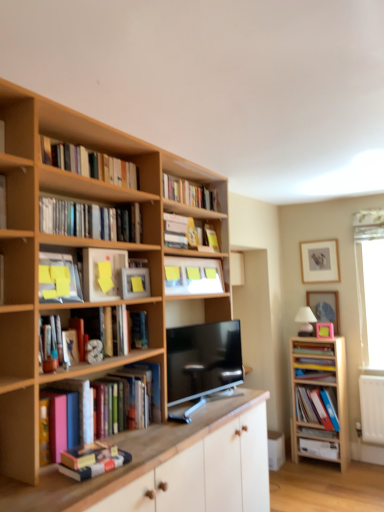
What do you see at coordinates (170, 467) in the screenshot?
I see `wooden cabinet at center, the first cabinetry in the front-to-back sequence` at bounding box center [170, 467].

What is the approximate height of matte yellow paper at center-left?

The height of matte yellow paper at center-left is 10.19 inches.

Where is `matte silver picture frame at upper right, the third picture frame from the bottom`? Image resolution: width=384 pixels, height=512 pixels. matte silver picture frame at upper right, the third picture frame from the bottom is located at coordinates (320, 261).

In the scene shown: What is the approximate width of matte silver picture frame at upper right, placed as the 1th picture frame when sorted from top to bottom?

matte silver picture frame at upper right, placed as the 1th picture frame when sorted from top to bottom, is 3.52 centimeters in width.

Measure the distance between point (x=311, y=365) and camera.

A distance of 11.98 feet exists between point (x=311, y=365) and camera.

What do you see at coordinates (313, 349) in the screenshot?
I see `wooden book at right, the fourth book ordered from the bottom` at bounding box center [313, 349].

Find the location of a particular element. This screenshot has height=512, width=384. matte wooden book at left, arranged as the third book when viewed from the top is located at coordinates (3, 203).

Which is farther, (188, 347) or (106, 209)?

Positioned behind is point (188, 347).

What's the angular difference between black glossy tv at center and hardcover books at upper left, which is the 4th book in top-to-bottom order,'s facing directions?

black glossy tv at center and hardcover books at upper left, which is the 4th book in top-to-bottom order, are facing 7.6 degrees away from each other.

Is black glossy tv at center in contact with hardcover books at upper left, which is the eighth book from bottom to top?

No.

From a real-world perspective, is black glossy tv at center under hardcover books at upper left, which is the eighth book from bottom to top?

Yes, from a real-world perspective, black glossy tv at center is below hardcover books at upper left, which is the eighth book from bottom to top.

From the image's perspective, between matte plastic book at left, which ranks as the sixth book in bottom-to-top order, and black glossy tv at center, who is located below?

black glossy tv at center, from the image's perspective.

Is point (40, 264) positioned after point (239, 353)?

No, it is in front of (239, 353).

Is matte plastic book at left, which ranks as the sixth book in bottom-to-top order, not within black glossy tv at center?

That's correct, matte plastic book at left, which ranks as the sixth book in bottom-to-top order, is outside of black glossy tv at center.

From a real-world perspective, is matte blue book at right, the tenth book in the top-to-bottom sequence, physically below pink matte picture frame at upper center, acting as the 3th picture frame starting from the top?

Yes, from a real-world perspective, matte blue book at right, the tenth book in the top-to-bottom sequence, is under pink matte picture frame at upper center, acting as the 3th picture frame starting from the top.

From the picture: Is the depth of matte blue book at right, the tenth book in the top-to-bottom sequence, less than that of pink matte picture frame at upper center, placed as the 1th picture frame when sorted from bottom to top?

Yes, matte blue book at right, the tenth book in the top-to-bottom sequence, is closer to the viewer.

From the image's perspective, starting from the matte blue book at right, the tenth book in the top-to-bottom sequence, which picture frame is the 1st one above? Please provide its 2D coordinates.

[(325, 330)]

Measure the distance between matte blue book at right, the tenth book in the top-to-bottom sequence, and pink matte picture frame at upper center, acting as the 3th picture frame starting from the top.

matte blue book at right, the tenth book in the top-to-bottom sequence, is 13.74 inches from pink matte picture frame at upper center, acting as the 3th picture frame starting from the top.

Considering the positions of points (181, 287) and (323, 335), is point (181, 287) farther from camera compared to point (323, 335)?

No, it is not.

Does yellow sticky notes at upper center touch pink matte picture frame at upper center, acting as the 3th picture frame starting from the top?

yellow sticky notes at upper center and pink matte picture frame at upper center, acting as the 3th picture frame starting from the top, are not in contact.

Could you measure the distance between yellow sticky notes at upper center and pink matte picture frame at upper center, acting as the 3th picture frame starting from the top?

yellow sticky notes at upper center and pink matte picture frame at upper center, acting as the 3th picture frame starting from the top, are 1.50 meters apart from each other.

From a real-world perspective, is yellow sticky notes at upper center positioned above or below pink matte picture frame at upper center, placed as the 1th picture frame when sorted from bottom to top?

From a real-world perspective, yellow sticky notes at upper center is physically above pink matte picture frame at upper center, placed as the 1th picture frame when sorted from bottom to top.

From a real-world perspective, is wooden cabinet at right, which appears as the 2th cabinetry when viewed from the left, beneath matte plastic book at left, the 6th book in the top-to-bottom sequence?

Yes, from a real-world perspective, wooden cabinet at right, which appears as the 2th cabinetry when viewed from the left, is under matte plastic book at left, the 6th book in the top-to-bottom sequence.

The height and width of the screenshot is (512, 384). I want to click on book that is the 6th object located in front of the wooden cabinet at right, which is the first cabinetry from back to front, so click(x=58, y=278).

How different are the orientations of wooden cabinet at right, which appears as the 2th cabinetry when viewed from the left, and matte plastic book at left, which ranks as the sixth book in bottom-to-top order, in degrees?

wooden cabinet at right, which appears as the 2th cabinetry when viewed from the left, and matte plastic book at left, which ranks as the sixth book in bottom-to-top order, are facing 93.5 degrees away from each other.

Does wooden cabinet at right, which is counted as the second cabinetry, starting from the front, lie in front of matte plastic book at left, the 6th book in the top-to-bottom sequence?

That is False.

Does wooden cabinet at right, which is counted as the second cabinetry, starting from the front, appear on the left side of wooden cabinet at center, the 2th cabinetry in the right-to-left sequence?

No.

Based on the photo, can you confirm if wooden cabinet at right, which appears as the 2th cabinetry when viewed from the left, is bigger than wooden cabinet at center, the 1th cabinetry from the left?

Actually, wooden cabinet at right, which appears as the 2th cabinetry when viewed from the left, might be smaller than wooden cabinet at center, the 1th cabinetry from the left.

Between wooden cabinet at right, which is counted as the second cabinetry, starting from the front, and wooden cabinet at center, the 1th cabinetry from the left, which one has larger width?

wooden cabinet at center, the 1th cabinetry from the left.

How distant is wooden cabinet at right, which appears as the 2th cabinetry when viewed from the left, from wooden cabinet at center, the first cabinetry in the front-to-back sequence?

They are 1.26 meters apart.

Can you confirm if matte wooden book at left, arranged as the third book when viewed from the top, is taller than hardcover book at lower left, which is counted as the seventh book, starting from the top?

Indeed, matte wooden book at left, arranged as the third book when viewed from the top, has a greater height compared to hardcover book at lower left, which is counted as the seventh book, starting from the top.

Is matte wooden book at left, arranged as the third book when viewed from the top, positioned with its back to hardcover book at lower left, which is counted as the 5th book, starting from the bottom?

No, hardcover book at lower left, which is counted as the 5th book, starting from the bottom, is not at the back of matte wooden book at left, arranged as the third book when viewed from the top.

Is matte wooden book at left, marked as the 9th book in a bottom-to-top arrangement, beside hardcover book at lower left, which is counted as the seventh book, starting from the top?

No, matte wooden book at left, marked as the 9th book in a bottom-to-top arrangement, is not with hardcover book at lower left, which is counted as the seventh book, starting from the top.

Find the location of a particular element. television below the hardcover books at upper left, which is the 4th book in top-to-bottom order (from the image's perspective) is located at coordinates (203, 360).

Locate an element on the screen. Image resolution: width=384 pixels, height=512 pixels. television behind the matte plastic book at left, the 6th book in the top-to-bottom sequence is located at coordinates (203, 360).

Looking at the image, which one is located closer to matte silver picture frame at upper right, the third picture frame from the bottom, matte blue book at right, which is the 2th book in bottom-to-top order, or hardcover book at right, acting as the 3th book starting from the bottom?

The object closer to matte silver picture frame at upper right, the third picture frame from the bottom, is hardcover book at right, acting as the 3th book starting from the bottom.

Considering their positions, is wooden book at right, the eighth book when ordered from top to bottom, positioned further to pink matte picture frame at upper center, placed as the 1th picture frame when sorted from bottom to top, than wooden bookshelf at upper left, which is counted as the first book, starting from the top?

Based on the image, wooden bookshelf at upper left, which is counted as the first book, starting from the top, appears to be further to pink matte picture frame at upper center, placed as the 1th picture frame when sorted from bottom to top.

Looking at the image, which one is located further to wooden bookcase at left, pink matte picture frame at upper center, acting as the 3th picture frame starting from the top, or hardcover book at upper center, the fifth book viewed from the top?

pink matte picture frame at upper center, acting as the 3th picture frame starting from the top, lies further to wooden bookcase at left than the other object.

Estimate the real-world distances between objects in this image. Which object is further from wooden cabinet at center, the 2th cabinetry in the right-to-left sequence, hardcover books at upper left, which is the eighth book from bottom to top, or hardcover book at upper center, placed as the 7th book when sorted from bottom to top?

hardcover book at upper center, placed as the 7th book when sorted from bottom to top, lies further to wooden cabinet at center, the 2th cabinetry in the right-to-left sequence, than the other object.

Estimate the real-world distances between objects in this image. Which object is further from hardcover book at upper center, placed as the 7th book when sorted from bottom to top, matte blue book at right, the eleventh book viewed from the top, or black glossy tv at center?

matte blue book at right, the eleventh book viewed from the top, is positioned further to the anchor hardcover book at upper center, placed as the 7th book when sorted from bottom to top.

When comparing their distances from wooden bookcase at left, does wooden bookshelf at upper left, placed as the eleventh book when sorted from bottom to top, or yellow sticky notes at upper center seem further?

yellow sticky notes at upper center.

Considering their positions, is wooden cabinet at center, which is the 2th cabinetry in back-to-front order, positioned further to hardcover book at lower left, which is counted as the seventh book, starting from the top, than wooden cabinet at right, which is counted as the second cabinetry, starting from the front?

wooden cabinet at right, which is counted as the second cabinetry, starting from the front.

Based on the photo, considering their positions, is matte blue book at right, which is the 2th book in bottom-to-top order, positioned further to matte wooden book at left, arranged as the third book when viewed from the top, than hardcover book at lower left, which is counted as the seventh book, starting from the top?

matte blue book at right, which is the 2th book in bottom-to-top order.

Locate an element on the screen. television between hardcover book at lower left, which is counted as the 5th book, starting from the bottom, and hardcover book at right, which appears as the 9th book when viewed from the top, from front to back is located at coordinates (203, 360).

Locate an element on the screen. The height and width of the screenshot is (512, 384). cabinet between matte plastic book at left, the 6th book in the top-to-bottom sequence, and matte blue book at right, which is the 2th book in bottom-to-top order, from front to back is located at coordinates (193, 276).

Locate an element on the screen. The width and height of the screenshot is (384, 512). cabinet located between matte wooden book at left, marked as the 9th book in a bottom-to-top arrangement, and black glossy tv at center in the left-right direction is located at coordinates (193, 276).

Identify the location of television between hardcover book at lower left, which is counted as the 5th book, starting from the bottom, and matte pink picture frame at upper right, which is the 2th picture frame in bottom-to-top order, in the front-back direction. (203, 360).